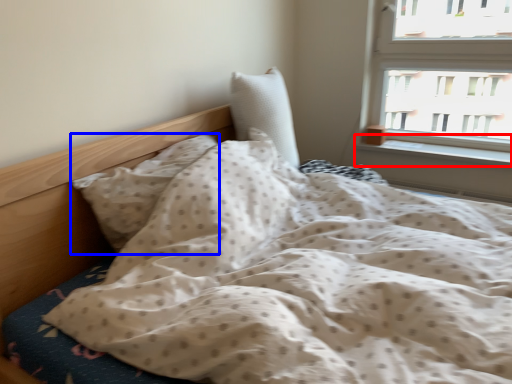
Question: Which point is further to the camera, window sill (highlighted by a red box) or pillow (highlighted by a blue box)?

Choices:
 (A) window sill
 (B) pillow

Answer: (A)